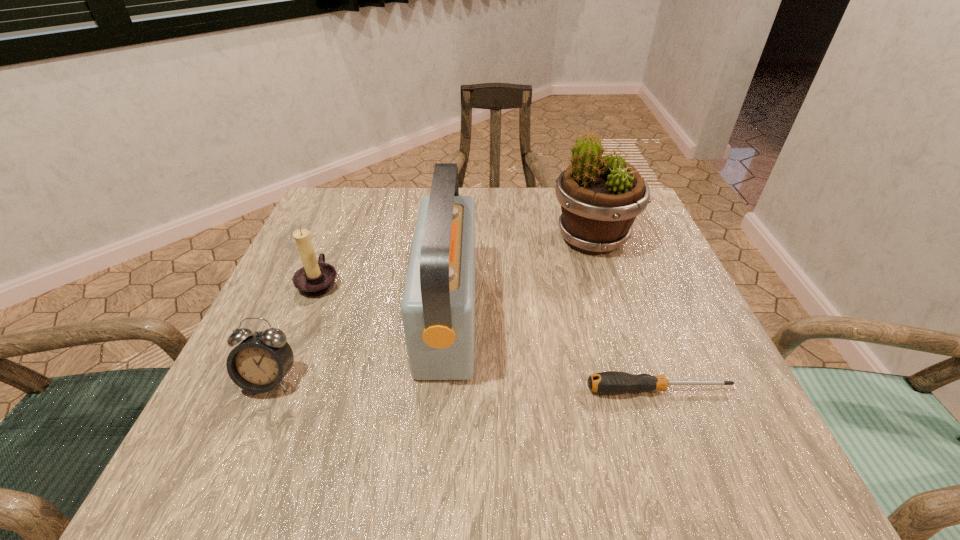
In the image, there is a desktop. At what (x,y) coordinates should I click in order to perform the action: click on vacant space at the far left corner. Please return your answer as a coordinate pair (x, y). The height and width of the screenshot is (540, 960). Looking at the image, I should click on (373, 220).

The image size is (960, 540). In the image, there is a desktop. Find the location of `vacant space at the far right corner`. vacant space at the far right corner is located at coordinates (644, 215).

Find the location of a particular element. free space between the candle holder and the shortest object is located at coordinates (489, 336).

Locate an element on the screen. The image size is (960, 540). empty space between the screwdriver and the fourth tallest object is located at coordinates (464, 385).

Locate an element on the screen. Image resolution: width=960 pixels, height=540 pixels. free spot between the alarm clock and the third object from left to right is located at coordinates (359, 347).

At what (x,y) coordinates should I click in order to perform the action: click on free space between the third object from right to left and the flowerpot. Please return your answer as a coordinate pair (x, y). The image size is (960, 540). Looking at the image, I should click on (520, 276).

The height and width of the screenshot is (540, 960). Identify the location of free point between the flowerpot and the screwdriver. (625, 314).

Where is `unoccupied area between the flowerpot and the radio receiver`? This screenshot has height=540, width=960. unoccupied area between the flowerpot and the radio receiver is located at coordinates (520, 276).

Image resolution: width=960 pixels, height=540 pixels. In order to click on vacant space in between the third tallest object and the screwdriver in this screenshot , I will do `click(489, 336)`.

The height and width of the screenshot is (540, 960). Find the location of `free space between the flowerpot and the screwdriver`. free space between the flowerpot and the screwdriver is located at coordinates (625, 314).